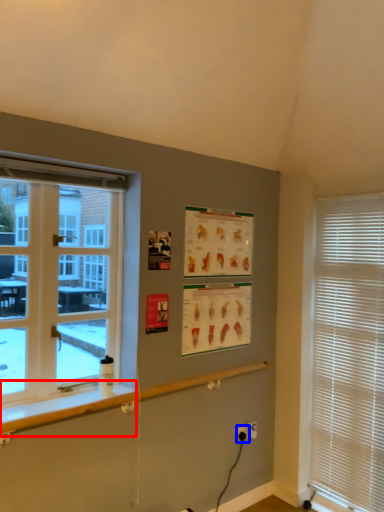
Question: Which point is further to the camera, window sill (highlighted by a red box) or electric outlet (highlighted by a blue box)?

Choices:
 (A) window sill
 (B) electric outlet

Answer: (B)